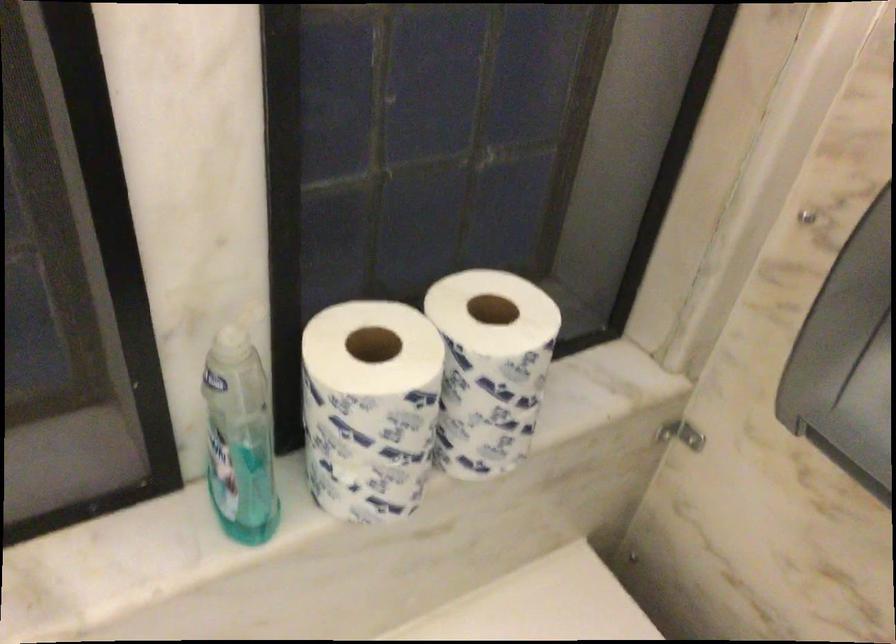
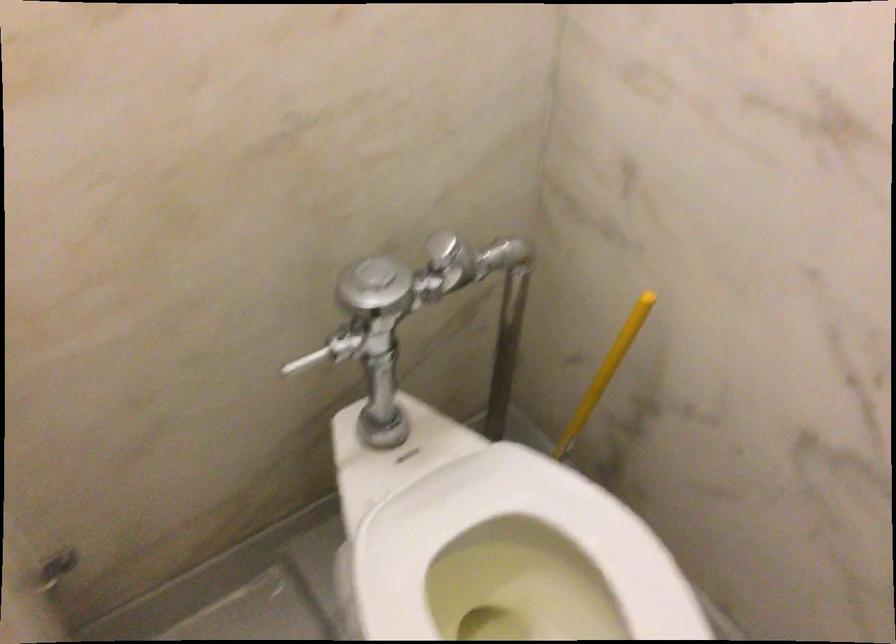
From the picture: The images are taken continuously from a first-person perspective. In which direction are you moving?

The cameraman walked toward right, forward.